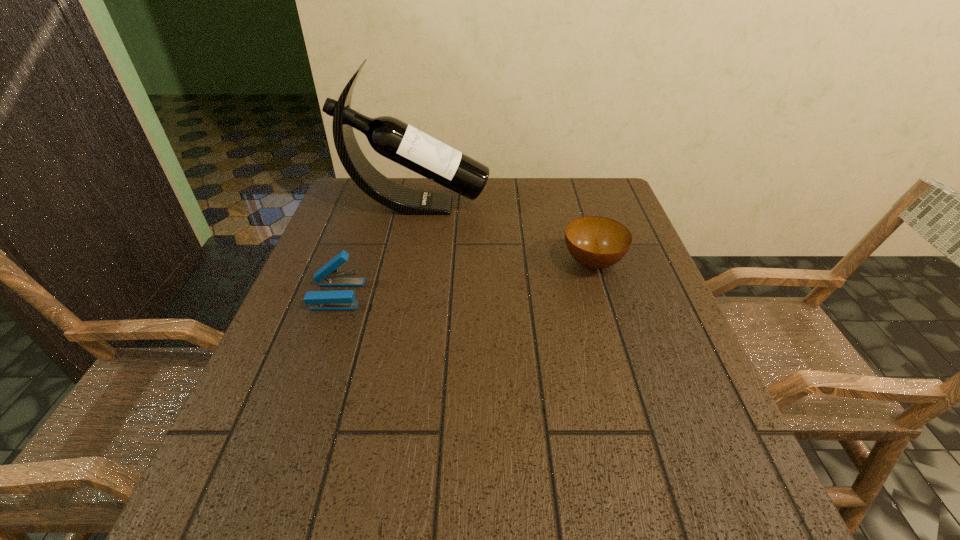
Where is `vacant area that lies between the bowl and the wine bottle`? The image size is (960, 540). vacant area that lies between the bowl and the wine bottle is located at coordinates (505, 234).

The height and width of the screenshot is (540, 960). I want to click on free area in between the stapler and the farthest object, so click(x=376, y=250).

Image resolution: width=960 pixels, height=540 pixels. What are the coordinates of `unoccupied position between the bowl and the stapler` in the screenshot? It's located at (465, 279).

I want to click on empty location between the rightmost object and the tallest object, so click(505, 234).

What are the coordinates of `vacant space in between the rightmost object and the farthest object` in the screenshot? It's located at (505, 234).

The image size is (960, 540). Find the location of `free space between the bowl and the farthest object`. free space between the bowl and the farthest object is located at coordinates (505, 234).

Image resolution: width=960 pixels, height=540 pixels. I want to click on free space between the farthest object and the bowl, so click(x=505, y=234).

Identify which object is located as the second nearest to the tallest object. Please provide its 2D coordinates. Your answer should be formatted as a tuple, i.e. [(x, y)], where the tuple contains the x and y coordinates of a point satisfying the conditions above.

[(327, 276)]

I want to click on object that is the closest to the tallest object, so click(596, 242).

Locate an element on the screen. This screenshot has width=960, height=540. free region that satisfies the following two spatial constraints: 1. on the stand of the farthest object; 2. on the right side of the rightmost object is located at coordinates (405, 263).